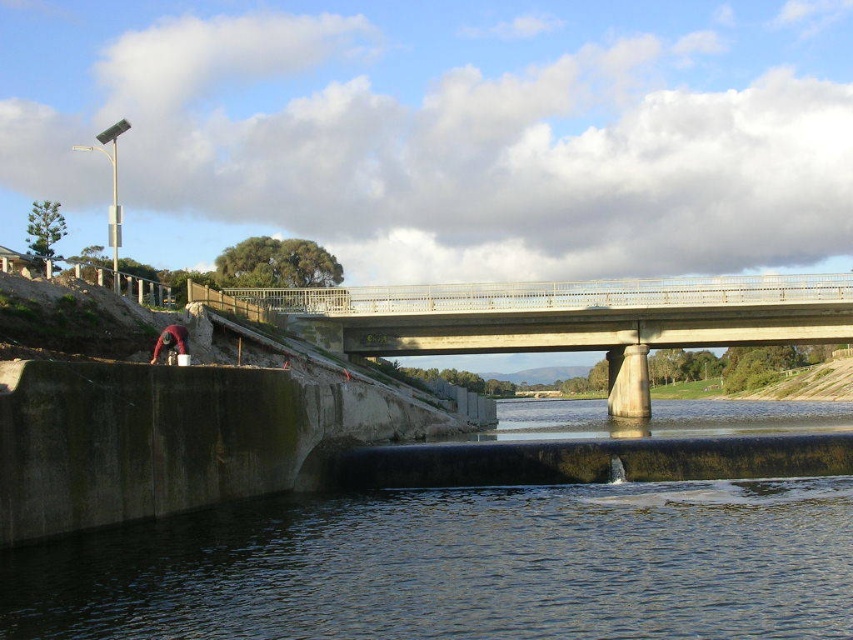
Is point (190, 588) closer to camera compared to point (618, 408)?

Yes, point (190, 588) is closer to viewer.

Does dark blue water at lower center come in front of concrete bridge at center?

Yes, it is in front of concrete bridge at center.

Find the location of a particular element. The height and width of the screenshot is (640, 853). dark blue water at lower center is located at coordinates (459, 566).